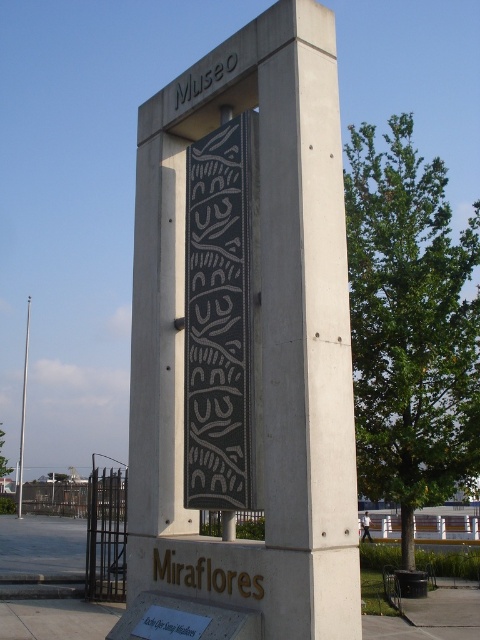
Question: Is gold metallic sign at lower center bigger than gold metallic text at lower center?

Choices:
 (A) yes
 (B) no

Answer: (A)

Question: Is the position of gold metallic sign at lower center less distant than that of gray concrete sign at upper center?

Choices:
 (A) no
 (B) yes

Answer: (B)

Question: Which object is farther from the camera taking this photo?

Choices:
 (A) gold metallic text at lower center
 (B) black textured stone at center
 (C) gray concrete sign at upper center

Answer: (C)

Question: Is black textured stone at center thinner than gray concrete sign at upper center?

Choices:
 (A) yes
 (B) no

Answer: (B)

Question: Which point is farther to the camera?

Choices:
 (A) (156, 630)
 (B) (244, 561)
 (C) (223, 365)

Answer: (C)

Question: Which of the following is the closest to the observer?

Choices:
 (A) (129, 560)
 (B) (184, 92)

Answer: (A)